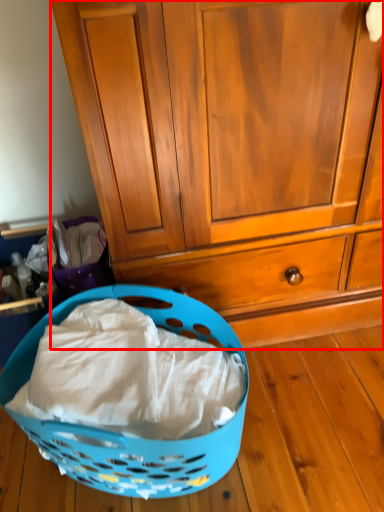
Question: From the image's perspective, where is cabinetry (annotated by the red box) located in relation to picnic basket in the image?

Choices:
 (A) above
 (B) below

Answer: (A)